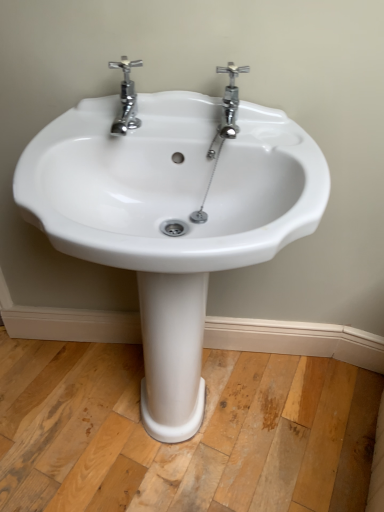
I want to click on blank space to the left of chrome/metallic faucet at upper left, positioned as the second tap in right-to-left order, so tap(75, 129).